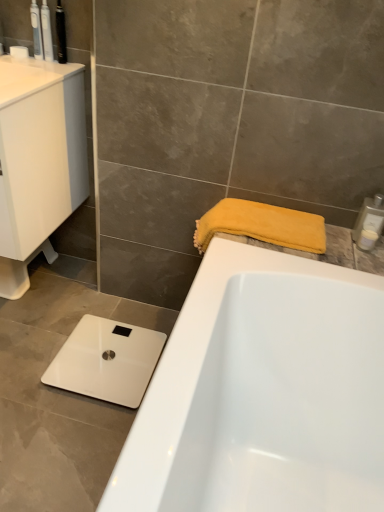
Question: Based on their sizes in the image, would you say metallic black toothbrush at upper left, the third toiletry when ordered from top to bottom, is bigger or smaller than white plastic soap dispenser at upper right, which is the fourth toiletry in left-to-right order?

Choices:
 (A) big
 (B) small

Answer: (A)

Question: From the image's perspective, is metallic black toothbrush at upper left, the third toiletry when ordered from top to bottom, above or below white plastic soap dispenser at upper right, which ranks as the second toiletry in right-to-left order?

Choices:
 (A) above
 (B) below

Answer: (A)

Question: Which object is the closest to the white plastic soap dispenser at upper right, the 4th toiletry from the top?

Choices:
 (A) metallic black toothbrush at upper left, the third toiletry positioned from the bottom
 (B) white glossy sink at left
 (C) matte white toothbrush at upper left, the 4th toiletry in the right-to-left sequence
 (D) yellow soft towel at upper right
 (E) white plastic soap dispenser at upper right, which ranks as the second toiletry in right-to-left order

Answer: (E)

Question: Considering the real-world distances, which object is closest to the yellow soft towel at upper right?

Choices:
 (A) white glossy cabinet at upper left
 (B) translucent plastic toothbrush at upper left, which is the first toiletry in top-to-bottom order
 (C) metallic black toothbrush at upper left, arranged as the 3th toiletry when viewed from the left
 (D) white glossy sink at left
 (E) white plastic soap dispenser at upper right, which is the fourth toiletry in left-to-right order

Answer: (E)